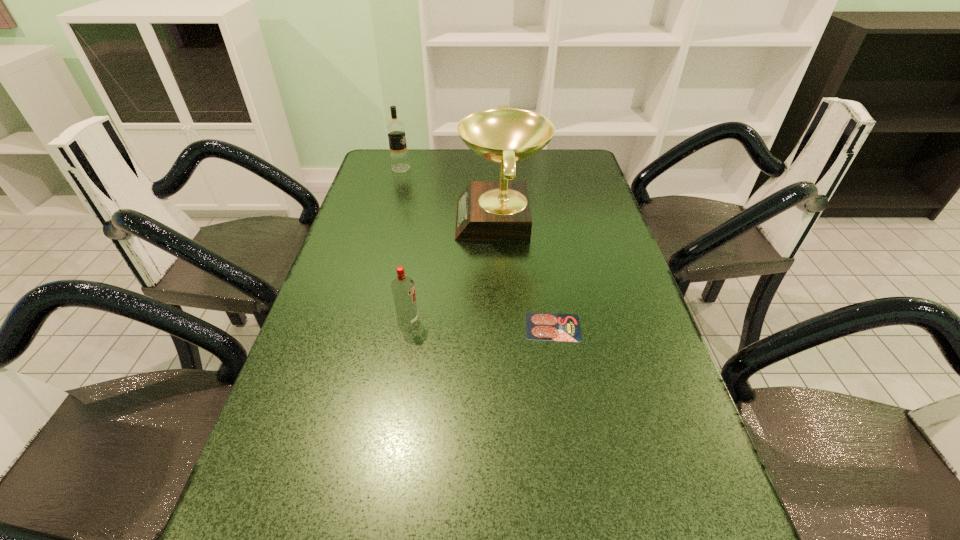
You are a GUI agent. You are given a task and a screenshot of the screen. Output one action in this format:
    pyautogui.click(x=<x>, y=<y>)
    Task: Click on the free location that satisfies the following two spatial constraints: 1. on the front label of the second shortest object; 2. on the back side of the salami
    Image resolution: width=960 pixels, height=540 pixels.
    Given the screenshot: What is the action you would take?
    pyautogui.click(x=407, y=327)